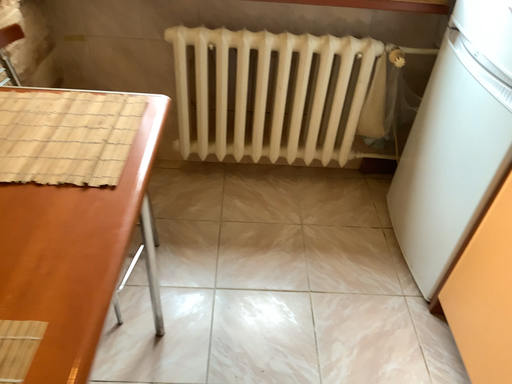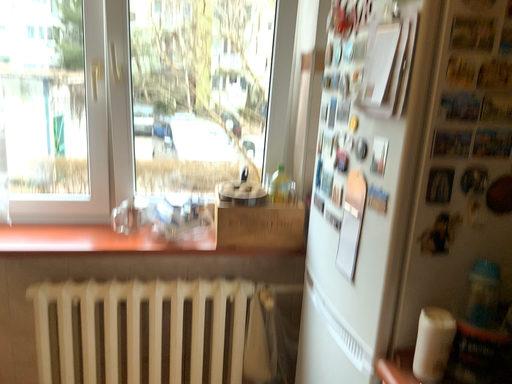
Question: How did the camera likely rotate when shooting the video?

Choices:
 (A) rotated upward
 (B) rotated downward

Answer: (A)